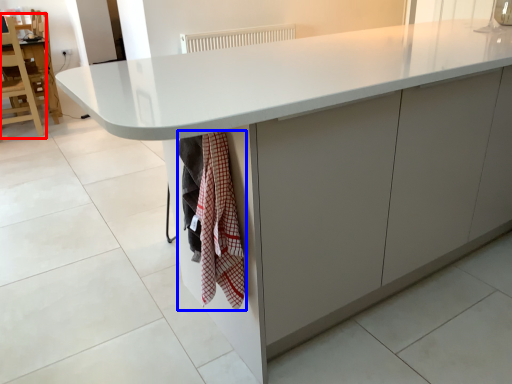
Question: Among these objects, which one is farthest to the camera, chair (highlighted by a red box) or blanket (highlighted by a blue box)?

Choices:
 (A) chair
 (B) blanket

Answer: (A)